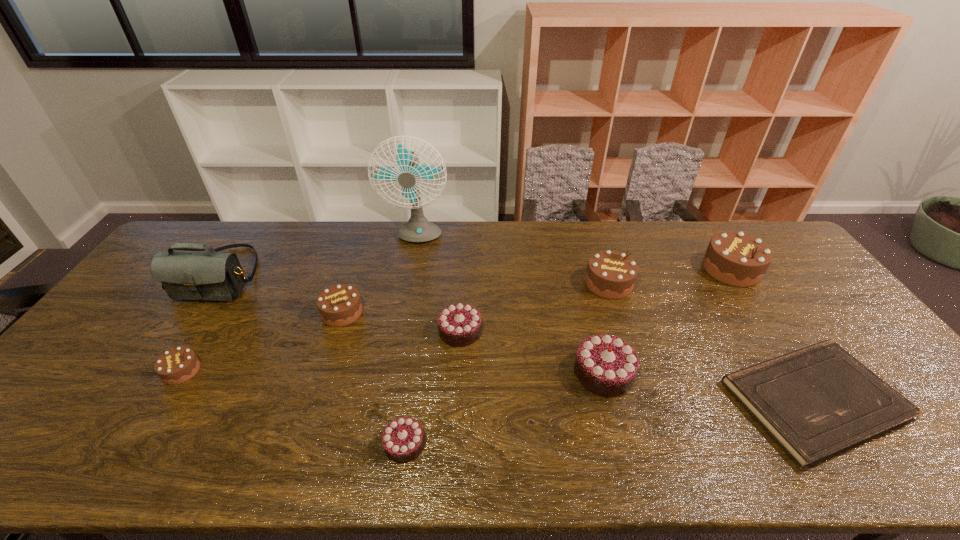
You are a GUI agent. You are given a task and a screenshot of the screen. Output one action in this format:
    pyautogui.click(x=<x>, y=<y>)
    Task: Click on the sixth chocolate cake from right to left
    The image size is (960, 540).
    Given the screenshot: What is the action you would take?
    pyautogui.click(x=339, y=305)

Where is `the fourth chocolate cake from right to left`? the fourth chocolate cake from right to left is located at coordinates (x=459, y=325).

Locate an element on the screen. This screenshot has width=960, height=540. the farthest chocolate chocolate cake is located at coordinates (459, 325).

Where is `the leftmost brown chocolate cake`? This screenshot has width=960, height=540. the leftmost brown chocolate cake is located at coordinates (177, 365).

Identify the location of the smallest brown chocolate cake. (177, 365).

This screenshot has width=960, height=540. Identify the location of the leftmost chocolate chocolate cake. (403, 440).

Where is `the nearest chocolate chocolate cake`? the nearest chocolate chocolate cake is located at coordinates (403, 440).

I want to click on the shortest object, so click(817, 402).

Where is `vacant space situated on the front-facing side of the tallest object`? This screenshot has width=960, height=540. vacant space situated on the front-facing side of the tallest object is located at coordinates (410, 278).

Where is `free space located on the front of the second tallest object`? Image resolution: width=960 pixels, height=540 pixels. free space located on the front of the second tallest object is located at coordinates coord(121,424).